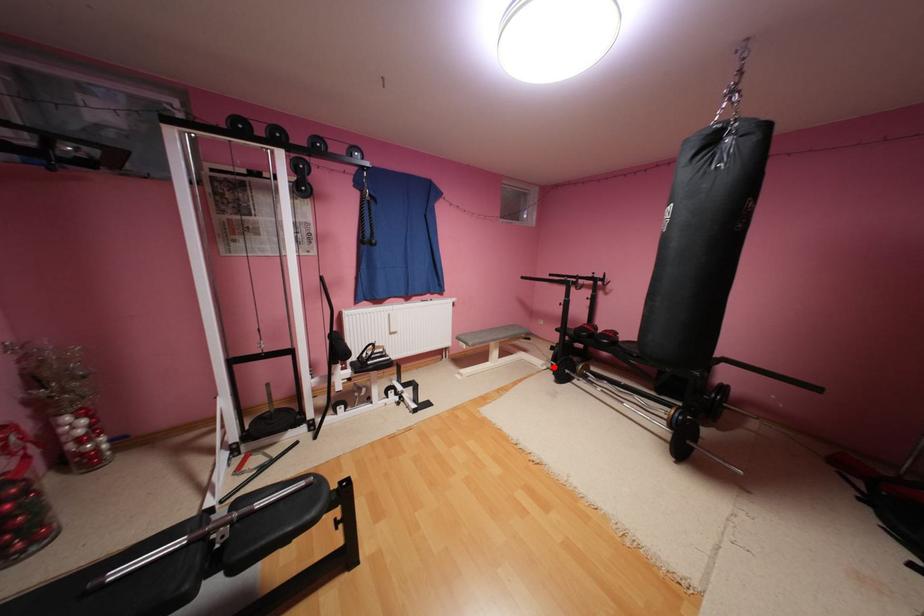
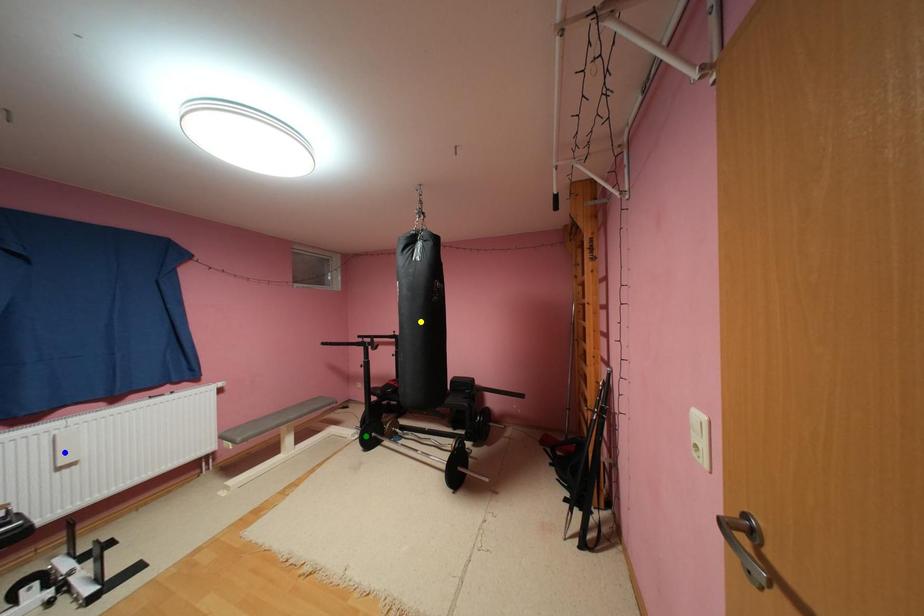
Question: I am providing you with two images of the same scene from different viewpoints. A red point is marked on the first image. You are given multiple points on the second image. Which point in image 2 represents the same 3d spot as the red point in image 1?

Choices:
 (A) yellow point
 (B) blue point
 (C) green point

Answer: (C)